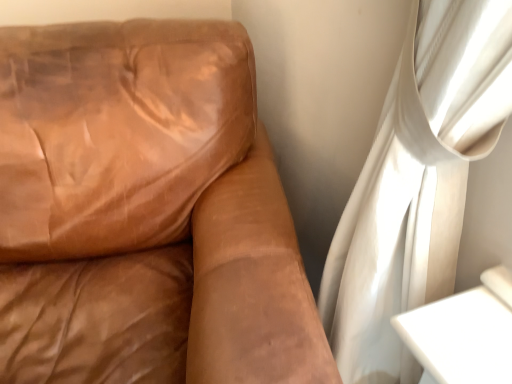
This screenshot has height=384, width=512. In order to click on brown leather couch at left in this screenshot , I will do `click(145, 213)`.

What do you see at coordinates (145, 213) in the screenshot?
I see `brown leather couch at left` at bounding box center [145, 213].

Locate an element on the screen. The width and height of the screenshot is (512, 384). brown leather couch at left is located at coordinates (145, 213).